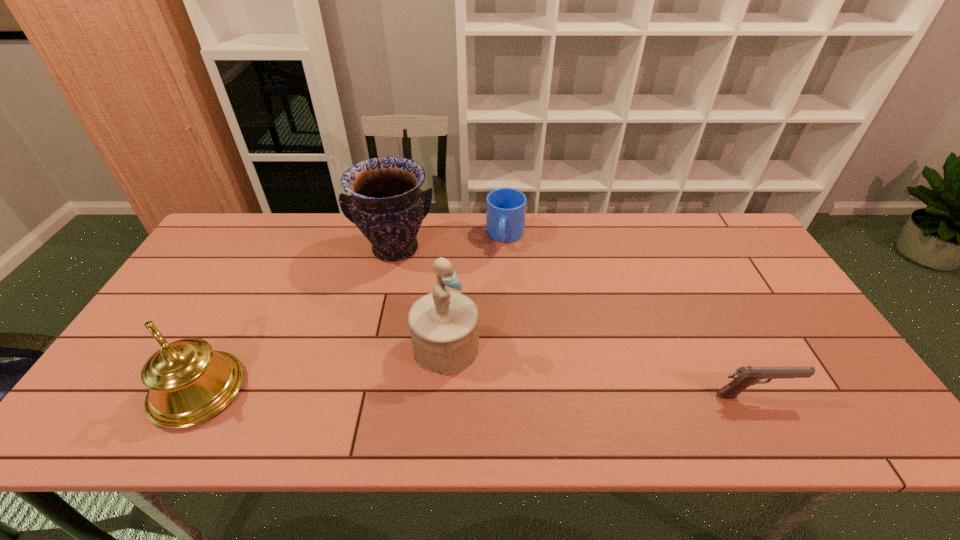
Where is `vacant space located 0.350m on the side of the second object from right to left with the handle`? vacant space located 0.350m on the side of the second object from right to left with the handle is located at coordinates (487, 336).

Where is `vacant area situated 0.150m on the front handle of the pottery`? This screenshot has width=960, height=540. vacant area situated 0.150m on the front handle of the pottery is located at coordinates (403, 309).

The image size is (960, 540). Find the location of `free space located 0.350m on the front handle of the pottery`. free space located 0.350m on the front handle of the pottery is located at coordinates (410, 368).

The image size is (960, 540). I want to click on vacant space located 0.310m on the front handle of the pottery, so click(409, 355).

The width and height of the screenshot is (960, 540). Find the location of `free space located at the beak of the figurine`. free space located at the beak of the figurine is located at coordinates (511, 397).

Locate an element on the screen. mug present at the far edge is located at coordinates (505, 207).

The width and height of the screenshot is (960, 540). I want to click on pottery that is at the far edge, so click(386, 204).

You are a GUI agent. You are given a task and a screenshot of the screen. Output one action in this format:
    pyautogui.click(x=<x>, y=<y>)
    Task: Click on the bell located at the near edge
    The height and width of the screenshot is (540, 960).
    Given the screenshot: What is the action you would take?
    pyautogui.click(x=189, y=383)

Where is `pistol that is at the near edge`? The height and width of the screenshot is (540, 960). pistol that is at the near edge is located at coordinates (745, 376).

What are the coordinates of `figurine positioned at the near edge` in the screenshot? It's located at (444, 329).